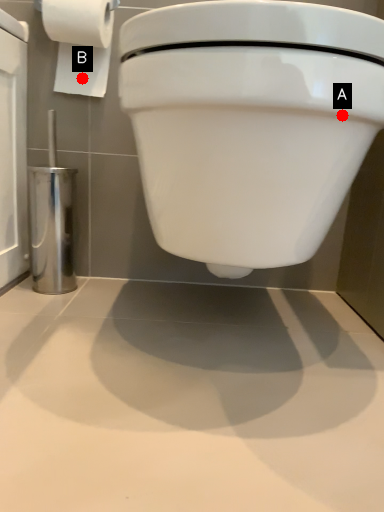
Question: Two points are circled on the image, labeled by A and B beside each circle. Which point is closer to the camera?

Choices:
 (A) A is closer
 (B) B is closer

Answer: (A)